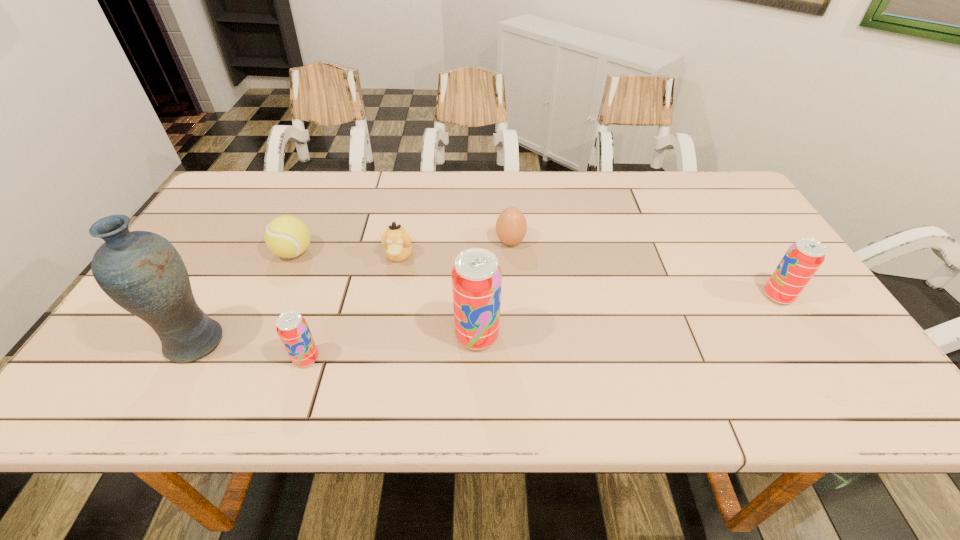
You are a GUI agent. You are given a task and a screenshot of the screen. Output one action in this format:
    pyautogui.click(x=<x>, y=<y>)
    Task: Click on the object present at the right edge
    The width and height of the screenshot is (960, 540).
    Given the screenshot: What is the action you would take?
    pyautogui.click(x=803, y=258)

Where is `object that is at the near left corner`? This screenshot has width=960, height=540. object that is at the near left corner is located at coordinates (141, 271).

Identify the location of blank space at the far edge of the desktop. (601, 172).

Locate an element on the screen. free space at the near edge of the desktop is located at coordinates (508, 350).

In order to click on vacant point at the right edge in this screenshot , I will do `click(730, 237)`.

Identify the location of vacant space at the far left corner of the desktop. The height and width of the screenshot is (540, 960). (250, 203).

Locate an element on the screen. This screenshot has width=960, height=540. unoccupied area between the tennis ball and the leftmost soda can is located at coordinates (300, 306).

This screenshot has height=540, width=960. In order to click on free point between the fourth object from right to left and the boiled egg in this screenshot , I will do `click(455, 249)`.

Identify the location of free space between the vase and the second tallest object. The image size is (960, 540). (336, 340).

This screenshot has height=540, width=960. Identify the location of vacant point located between the second tallest soda can and the leftmost soda can. (542, 327).